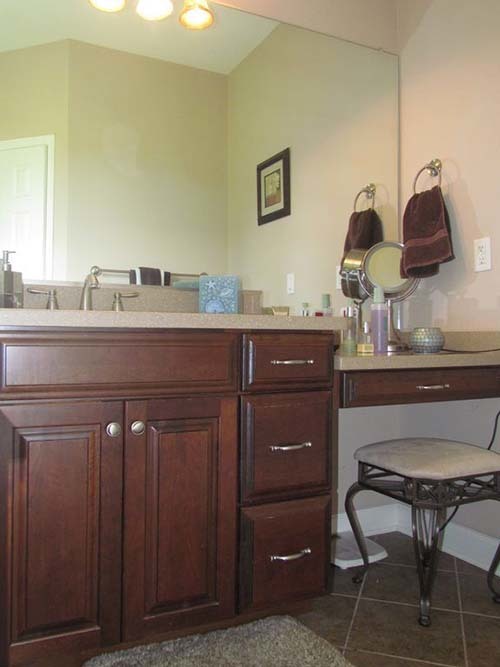
Where is `drawers`? drawers is located at coordinates (289, 351), (289, 430), (295, 537), (400, 380).